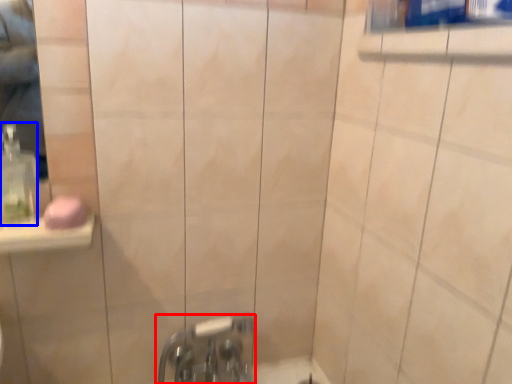
Question: Which of the following is the farthest to the observer, tap (highlighted by a red box) or soap dispenser (highlighted by a blue box)?

Choices:
 (A) tap
 (B) soap dispenser

Answer: (A)